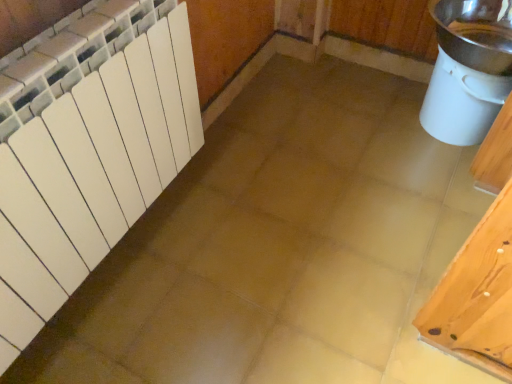
This screenshot has height=384, width=512. In order to click on free space on the front side of white plastic bucket at right in this screenshot , I will do `click(438, 188)`.